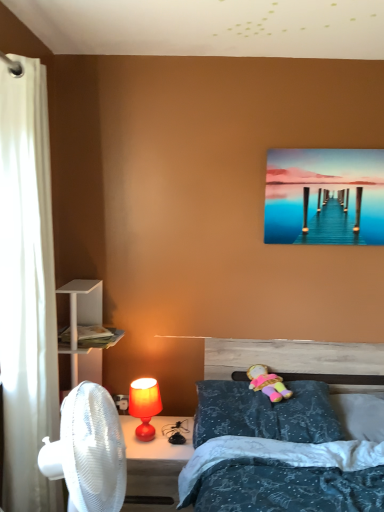
Find the location of `vacant space underneath matte orange lamp at lower left (from a real-world perspective)`. vacant space underneath matte orange lamp at lower left (from a real-world perspective) is located at coordinates (143, 442).